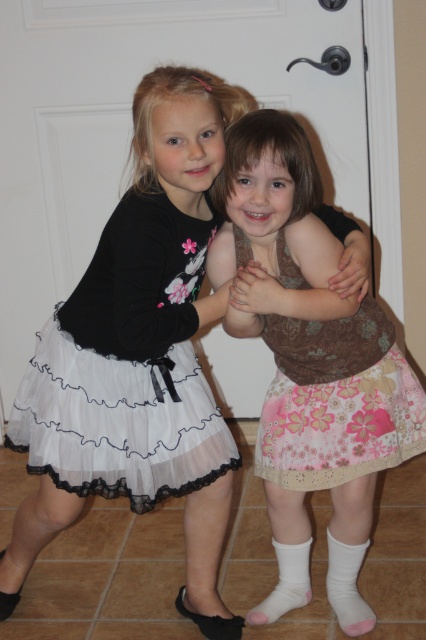
Is white sheer skirt at center further to camera compared to floral cotton skirt at center?

No, it is in front of floral cotton skirt at center.

In order to click on white sheer skirt at center in this screenshot , I will do `click(126, 368)`.

Which is more to the left, pink floral skirt at center or floral cotton skirt at center?

floral cotton skirt at center is more to the left.

Is pink floral skirt at center wider than floral cotton skirt at center?

Correct, the width of pink floral skirt at center exceeds that of floral cotton skirt at center.

Describe the element at coordinates (308, 364) in the screenshot. This screenshot has width=426, height=640. I see `pink floral skirt at center` at that location.

The image size is (426, 640). Identify the location of pink floral skirt at center. (308, 364).

Is point (264, 236) less distant than point (164, 492)?

Yes, point (264, 236) is closer to viewer.

Between pink floral skirt at center and white sheer skirt at center, which one has more height?

pink floral skirt at center

Is point (339, 330) behind point (138, 440)?

No.

The width and height of the screenshot is (426, 640). I want to click on pink floral skirt at center, so click(x=308, y=364).